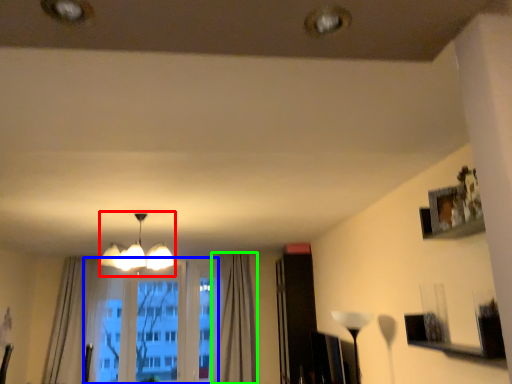
Question: Based on their relative distances, which object is nearer to lamp (highlighted by a red box)? Choose from bay window (highlighted by a blue box) and curtain (highlighted by a green box).

Choices:
 (A) bay window
 (B) curtain

Answer: (B)